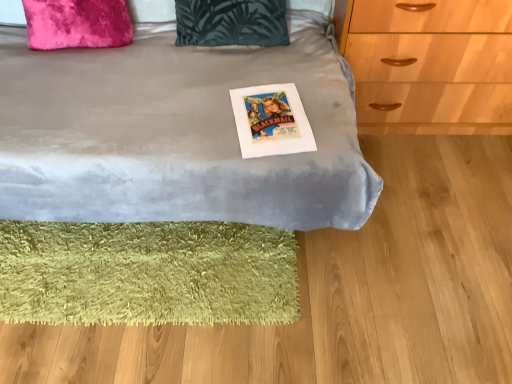
Question: In terms of width, does velvet pink pillow at upper left, the 1th pillow viewed from the left, look wider or thinner when compared to velvet gray bed at center?

Choices:
 (A) thin
 (B) wide

Answer: (A)

Question: In terms of size, does velvet pink pillow at upper left, arranged as the 2th pillow when viewed from the right, appear bigger or smaller than velvet gray bed at center?

Choices:
 (A) big
 (B) small

Answer: (B)

Question: Which is nearer to the velvet gray bed at center?

Choices:
 (A) velvet pink pillow at upper left, the 1th pillow viewed from the left
 (B) dark green fabric pillow at upper center, which is the 1th pillow in right-to-left order
 (C) white paper poster at center
 (D) green shaggy rug at lower left

Answer: (C)

Question: Considering the real-world distances, which object is farthest from the velvet gray bed at center?

Choices:
 (A) white paper poster at center
 (B) velvet pink pillow at upper left, arranged as the 2th pillow when viewed from the right
 (C) green shaggy rug at lower left
 (D) dark green fabric pillow at upper center, placed as the second pillow when sorted from left to right

Answer: (B)